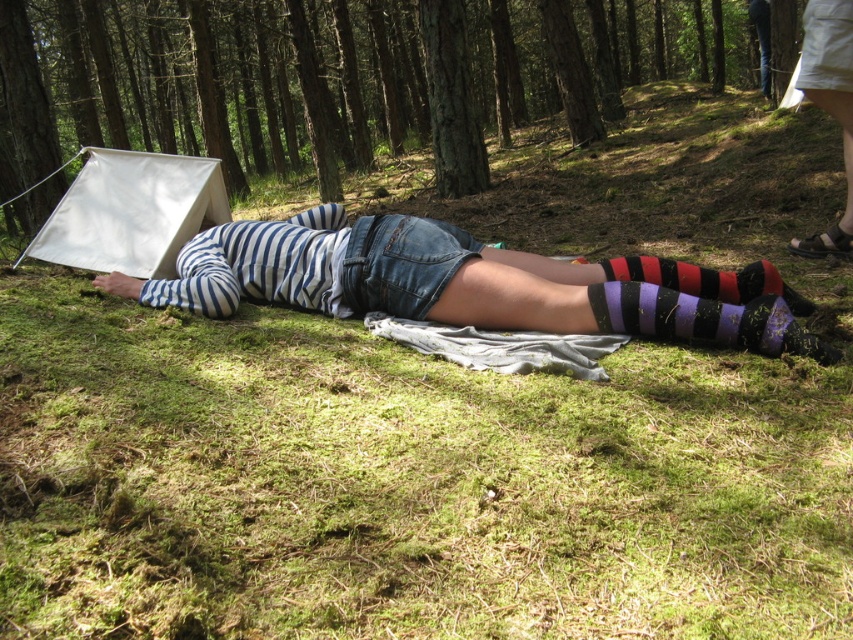
Which is behind, point (22, 230) or point (729, 280)?

Positioned behind is point (22, 230).

Does green mossy ground at center appear under striped fabric at center?

No.

Where is `green mossy ground at center`? The image size is (853, 640). green mossy ground at center is located at coordinates (155, 84).

Does green mossy ground at center appear under purple striped sock at lower center?

No.

Who is higher up, green mossy ground at center or purple striped sock at lower center?

Positioned higher is green mossy ground at center.

Where is `green mossy ground at center`? The image size is (853, 640). green mossy ground at center is located at coordinates (155, 84).

Is point (457, 253) closer to viewer compared to point (708, 307)?

No.

Where is `striped fabric at center`? striped fabric at center is located at coordinates (473, 284).